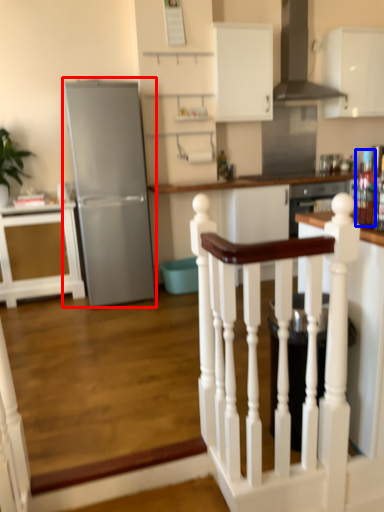
Question: Which object is closer to the camera taking this photo, refrigerator (highlighted by a red box) or appliance (highlighted by a blue box)?

Choices:
 (A) refrigerator
 (B) appliance

Answer: (B)